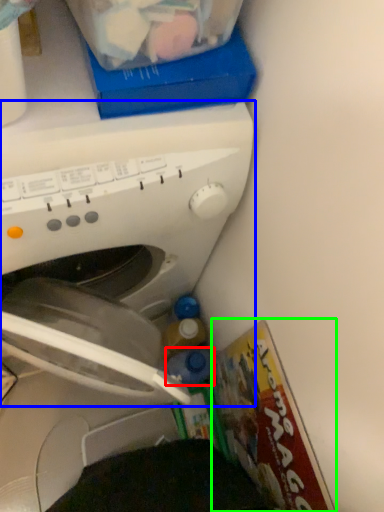
Question: Estimate the real-world distances between objects in this image. Which object is closer to bottle (highlighted by a red box), washing machine (highlighted by a blue box) or magazine (highlighted by a green box)?

Choices:
 (A) washing machine
 (B) magazine

Answer: (B)